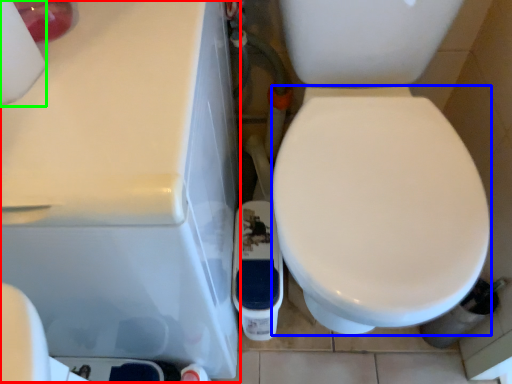
Question: Which object is positioned farthest from porcelain (highlighted by a red box)? Select from bidet (highlighted by a blue box) and toilet paper (highlighted by a green box).

Choices:
 (A) bidet
 (B) toilet paper

Answer: (A)